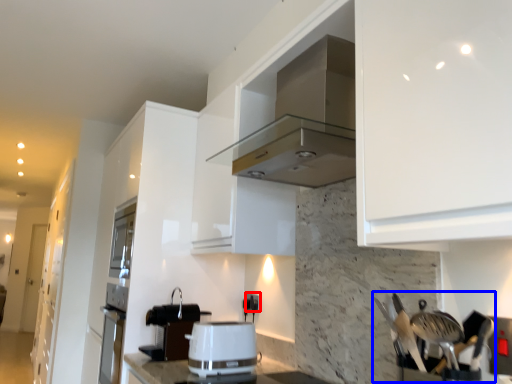
Question: Among these objects, which one is nearest to the camera, electric outlet (highlighted by a red box) or silverware (highlighted by a blue box)?

Choices:
 (A) electric outlet
 (B) silverware

Answer: (B)